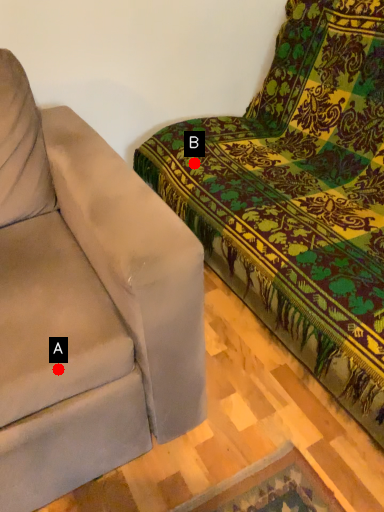
Question: Two points are circled on the image, labeled by A and B beside each circle. Which point is farther to the camera?

Choices:
 (A) A is further
 (B) B is further

Answer: (B)